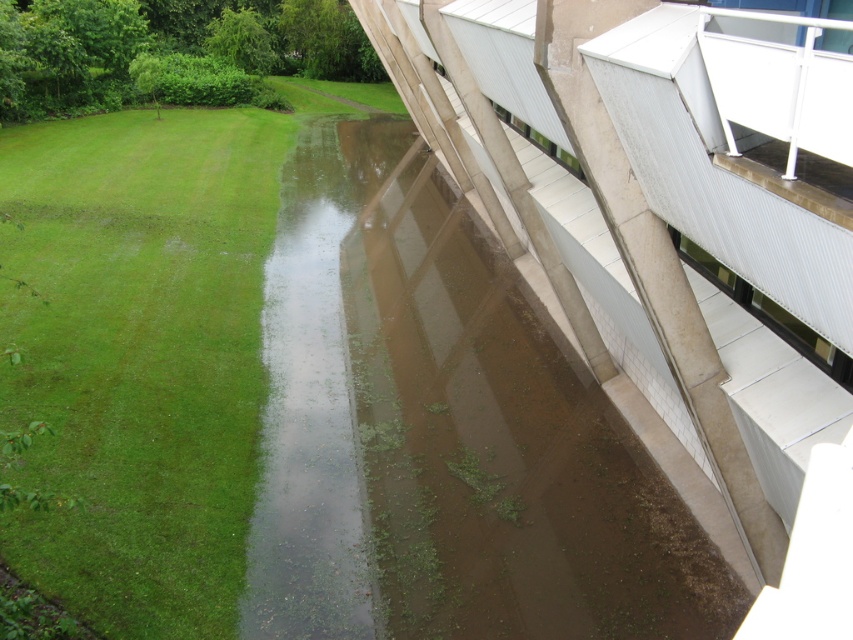
You are standing in the middle of the scene and want to walk towards the green grass at lower left. Which direction should you move relative to the brown concrete at center?

You should move away from the brown concrete at center towards the green grass at lower left because the brown concrete at center is closer to you than the green grass at lower left.

You are a landscape architect designing a drainage system. You need to ensure that the brown concrete at center and the green grass at lower left are proportionate. According to the scene, which area is narrower?

The brown concrete at center is narrower than the green grass at lower left because its width is less than the grass area.

You are standing on the green grass at lower left and want to cross to the brown concrete at center. Which direction should you walk to reach it?

The brown concrete at center is positioned on the right side of green grass at lower left, so you should walk to the right to reach it.